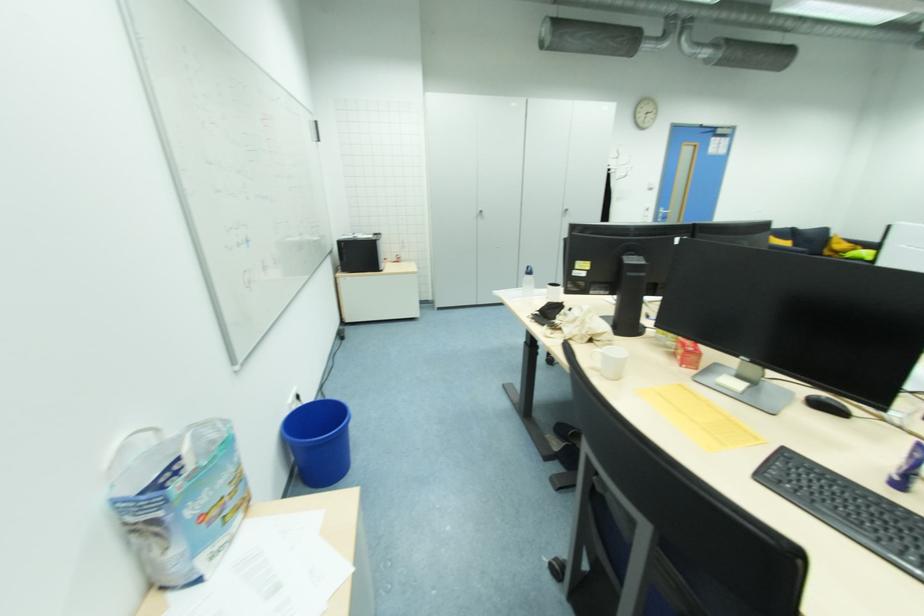
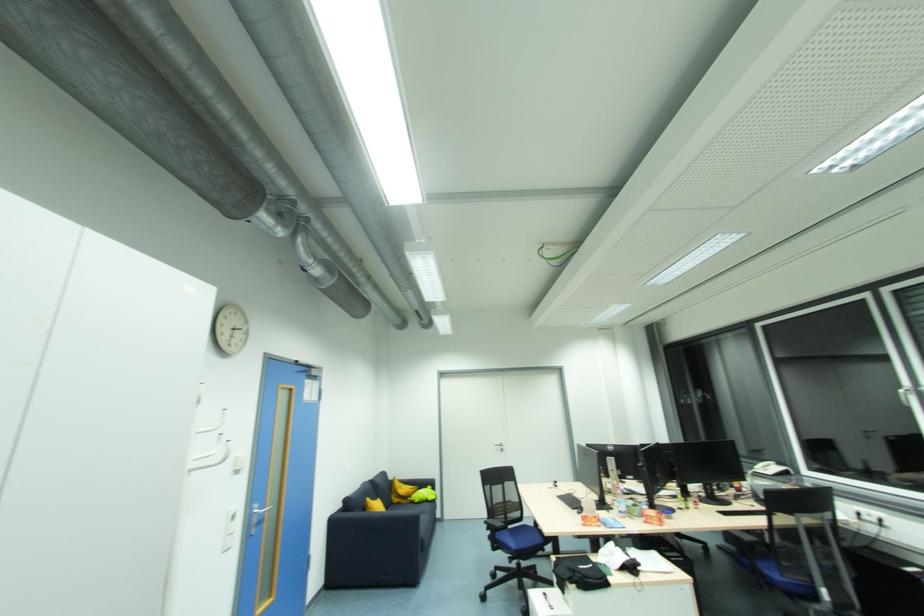
Find the pixel in the second image that matches point (650, 211) in the first image.

(236, 520)